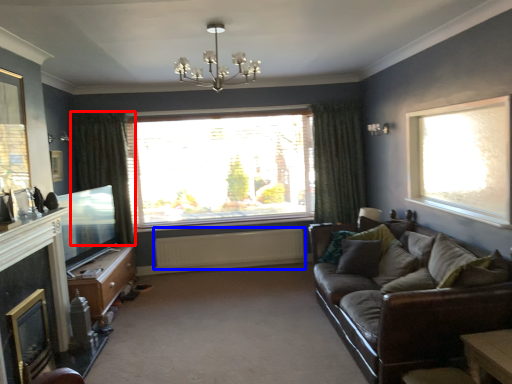
Question: Which of the following is the closest to the observer, curtain (highlighted by a red box) or radiator (highlighted by a blue box)?

Choices:
 (A) curtain
 (B) radiator

Answer: (A)